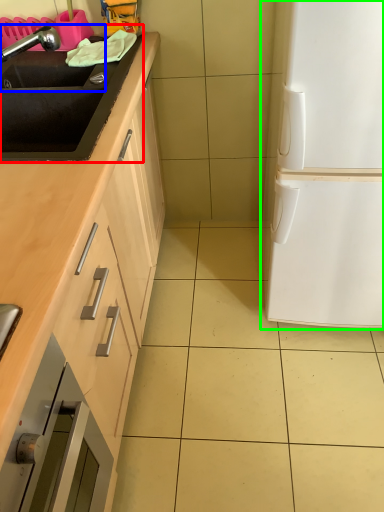
Question: Which is nearer to the sink (highlighted by a red box)? sink (highlighted by a blue box) or fridge (highlighted by a green box).

Choices:
 (A) sink
 (B) fridge

Answer: (A)